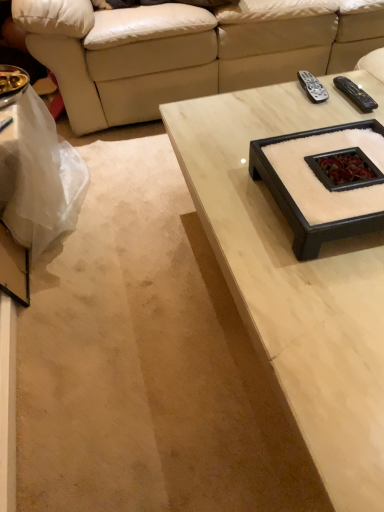
Question: Is white marble coffee table at upper center thinner than beige leather couch at upper center?

Choices:
 (A) yes
 (B) no

Answer: (A)

Question: Does white marble coffee table at upper center lie behind beige leather couch at upper center?

Choices:
 (A) no
 (B) yes

Answer: (A)

Question: From the image's perspective, is white marble coffee table at upper center above beige leather couch at upper center?

Choices:
 (A) no
 (B) yes

Answer: (A)

Question: Considering the relative sizes of white marble coffee table at upper center and beige leather couch at upper center in the image provided, is white marble coffee table at upper center smaller than beige leather couch at upper center?

Choices:
 (A) no
 (B) yes

Answer: (B)

Question: From the image's perspective, is white marble coffee table at upper center below beige leather couch at upper center?

Choices:
 (A) no
 (B) yes

Answer: (B)

Question: Is white marble coffee table at upper center at the right side of beige leather couch at upper center?

Choices:
 (A) yes
 (B) no

Answer: (A)

Question: From the image's perspective, is white marble coffee table at upper center located beneath black plastic remote at upper right, placed as the 1th remote when sorted from left to right?

Choices:
 (A) no
 (B) yes

Answer: (B)

Question: Does white marble coffee table at upper center appear on the right side of black plastic remote at upper right, placed as the 1th remote when sorted from left to right?

Choices:
 (A) no
 (B) yes

Answer: (B)

Question: Could black plastic remote at upper right, arranged as the second remote when viewed from the right, be considered to be inside white marble coffee table at upper center?

Choices:
 (A) no
 (B) yes

Answer: (B)

Question: From a real-world perspective, is white marble coffee table at upper center physically above black plastic remote at upper right, placed as the 1th remote when sorted from left to right?

Choices:
 (A) yes
 (B) no

Answer: (B)

Question: From a real-world perspective, is white marble coffee table at upper center positioned under black plastic remote at upper right, arranged as the second remote when viewed from the right, based on gravity?

Choices:
 (A) no
 (B) yes

Answer: (B)

Question: Does white marble coffee table at upper center have a smaller size compared to black plastic remote at upper right, arranged as the second remote when viewed from the right?

Choices:
 (A) no
 (B) yes

Answer: (A)

Question: From a real-world perspective, is black plastic remote at upper right, arranged as the second remote when viewed from the right, physically above white plastic bag at lower left?

Choices:
 (A) no
 (B) yes

Answer: (B)